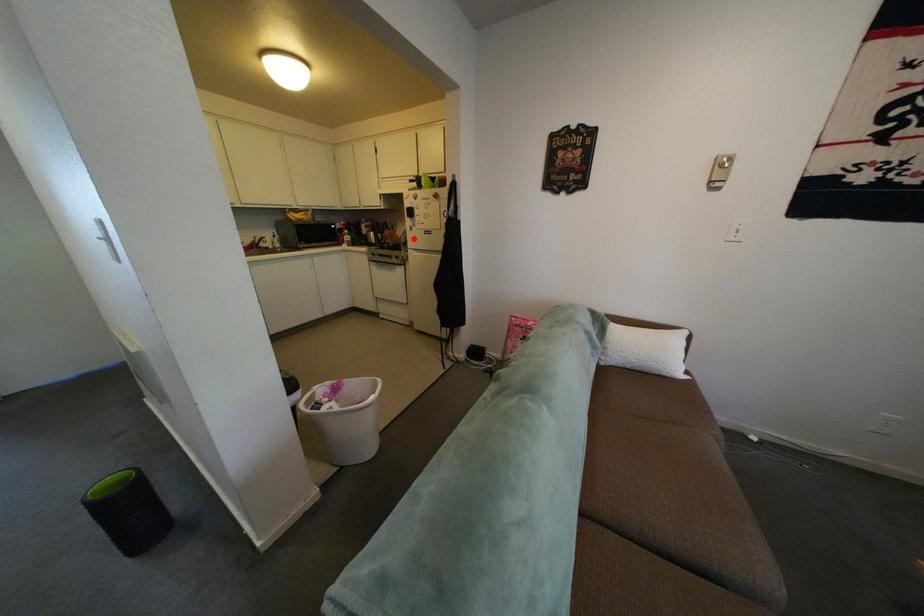
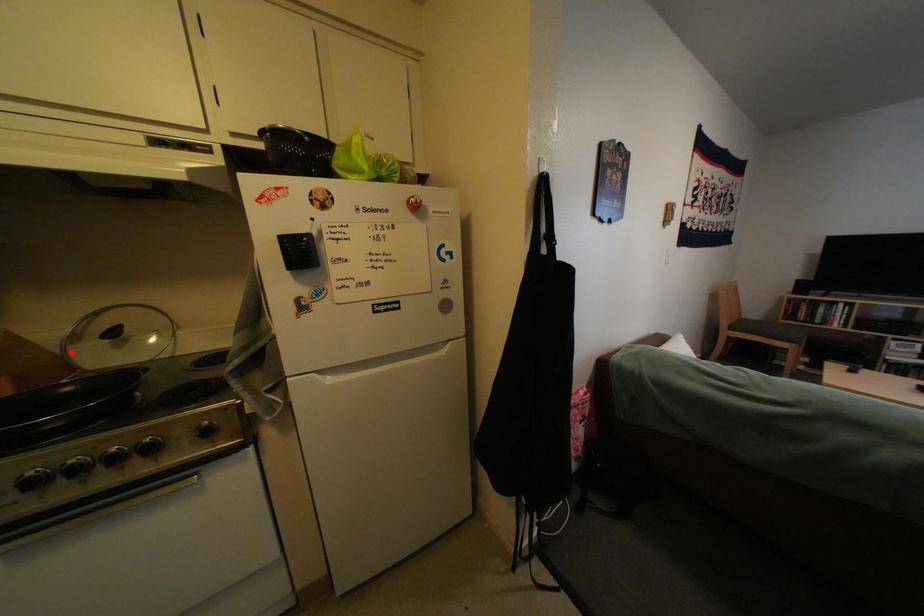
I am providing you with two images of the same scene from different viewpoints. A red point is marked on the first image and another point is marked on the second image. Does the point marked in image1 correspond to the same location as the one in image2?

Yes